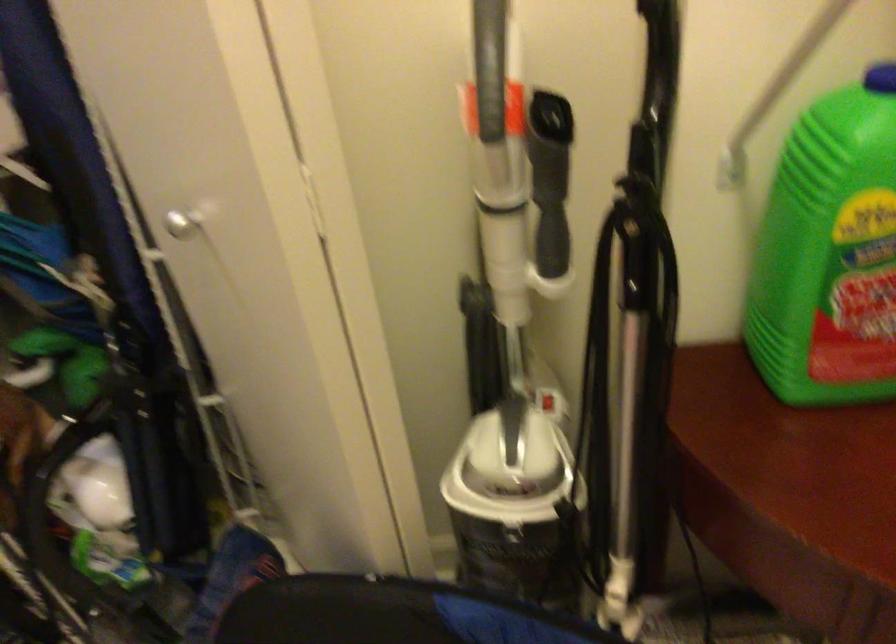
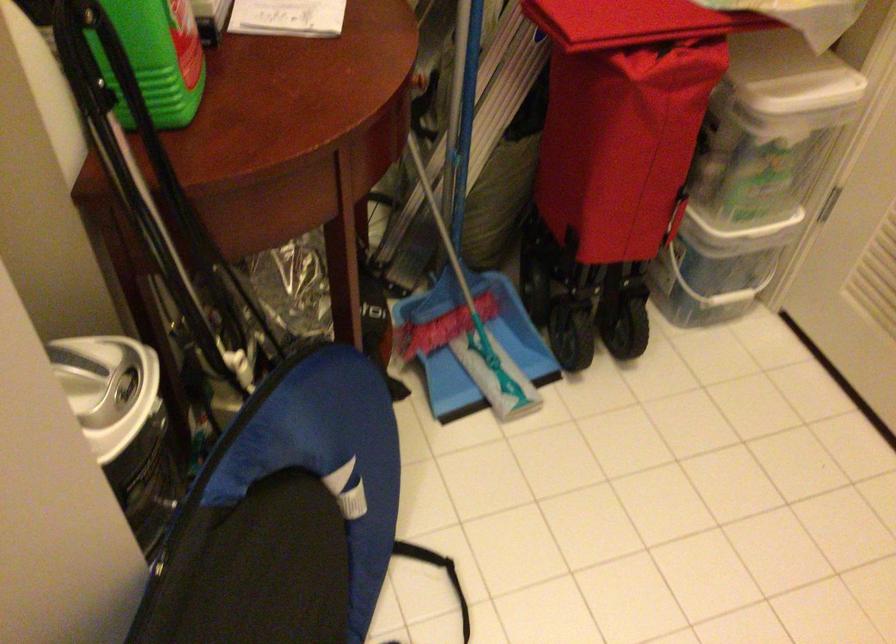
In the second image, find the point that corresponds to the point at 478,504 in the first image.

(123, 424)